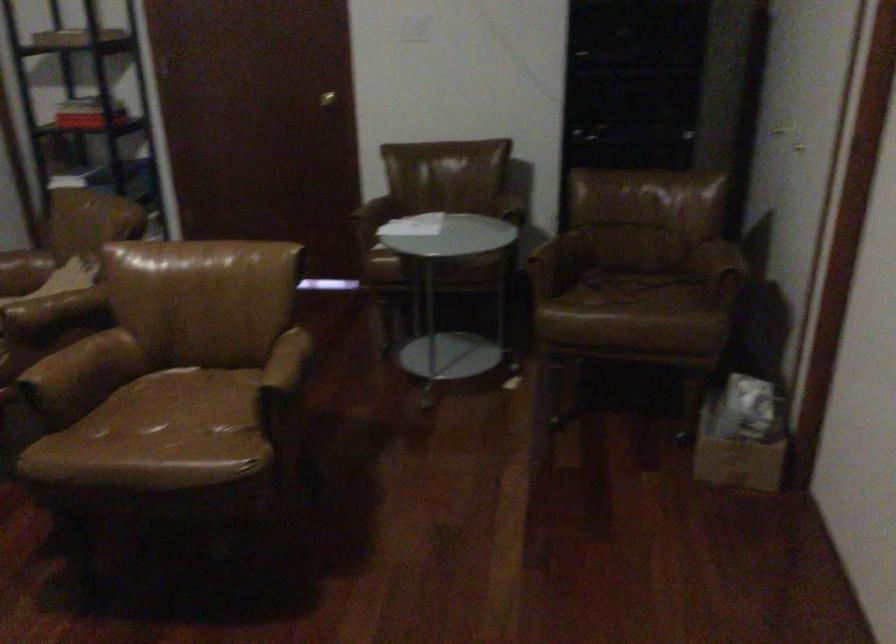
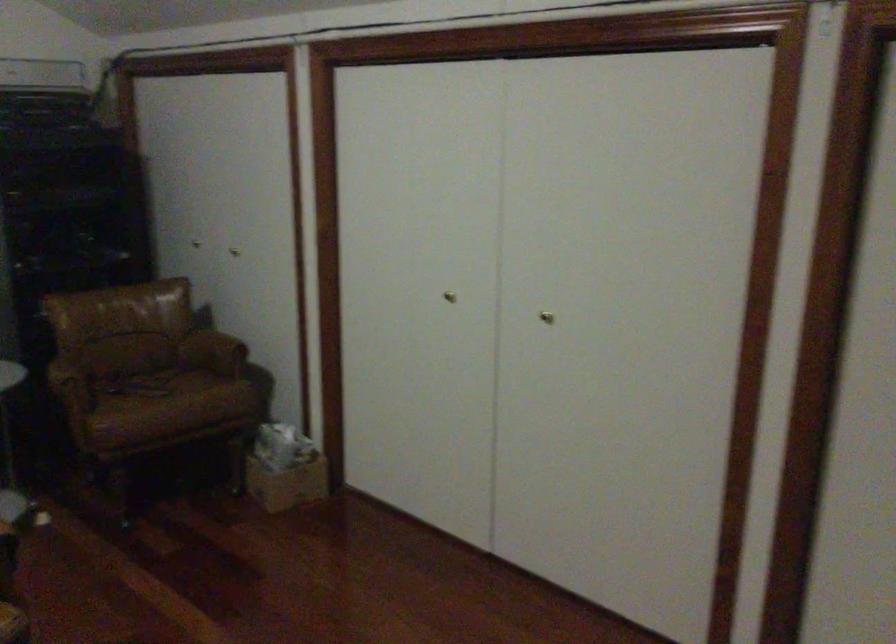
Where in the second image is the point corresponding to pixel 722 453 from the first image?

(287, 484)